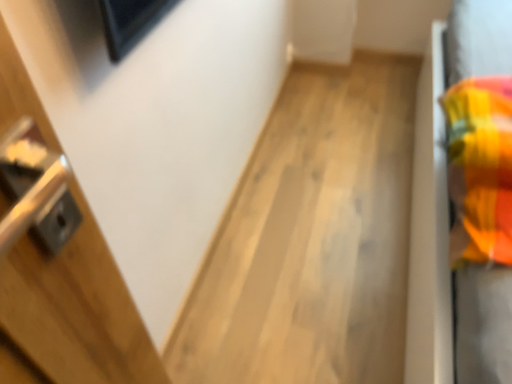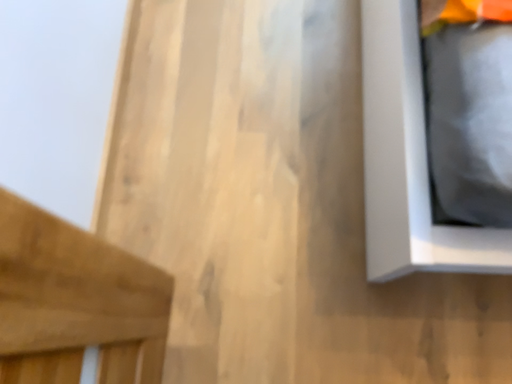
Question: How did the camera likely rotate when shooting the video?

Choices:
 (A) rotated left
 (B) rotated right

Answer: (B)